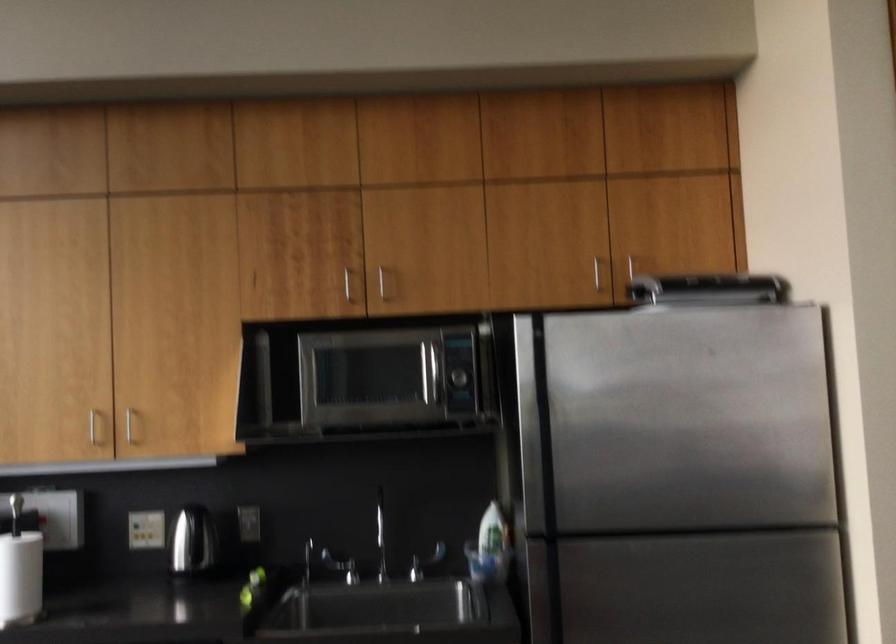
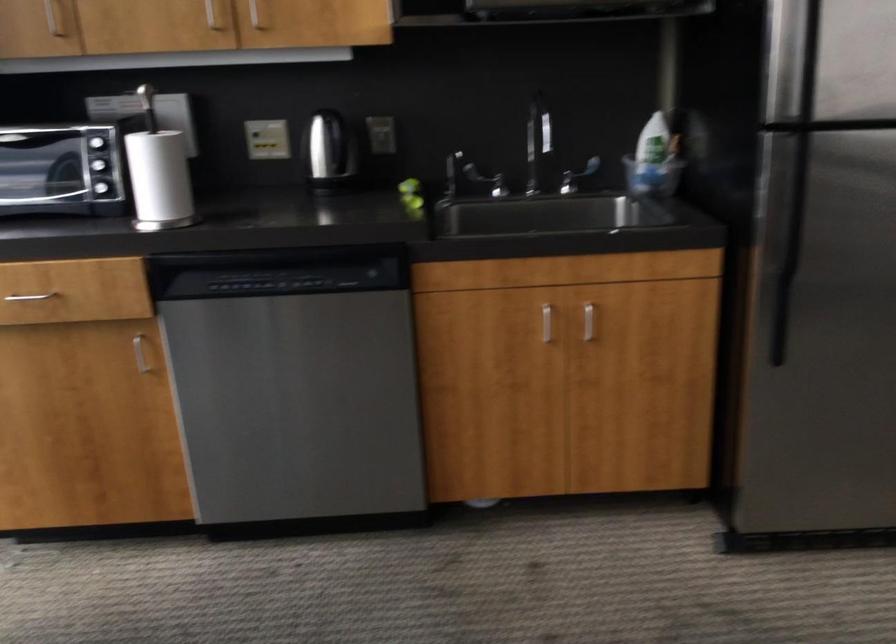
Find the pixel in the second image that matches [485,540] in the first image.

(650, 155)